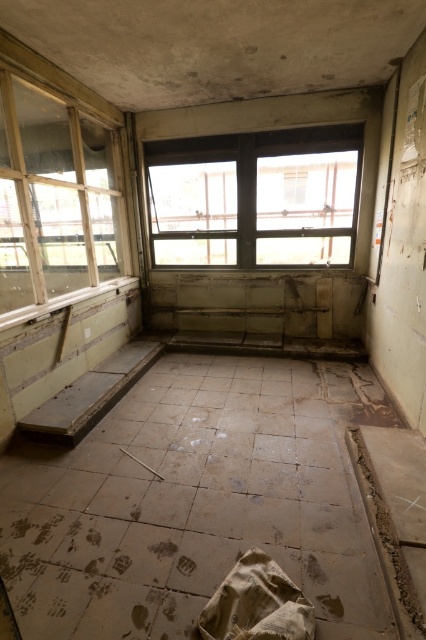
Question: Among these points, which one is farthest from the camera?

Choices:
 (A) (189, 176)
 (B) (37, 296)

Answer: (A)

Question: Can you confirm if transparent glass window at center is bigger than transparent glass window at left?

Choices:
 (A) yes
 (B) no

Answer: (B)

Question: Which point is closer to the camera?

Choices:
 (A) (52, 227)
 (B) (334, 182)

Answer: (B)

Question: Does transparent glass window at center have a smaller size compared to transparent glass window at left?

Choices:
 (A) yes
 (B) no

Answer: (A)

Question: Can you confirm if transparent glass window at center is smaller than transparent glass window at left?

Choices:
 (A) yes
 (B) no

Answer: (A)